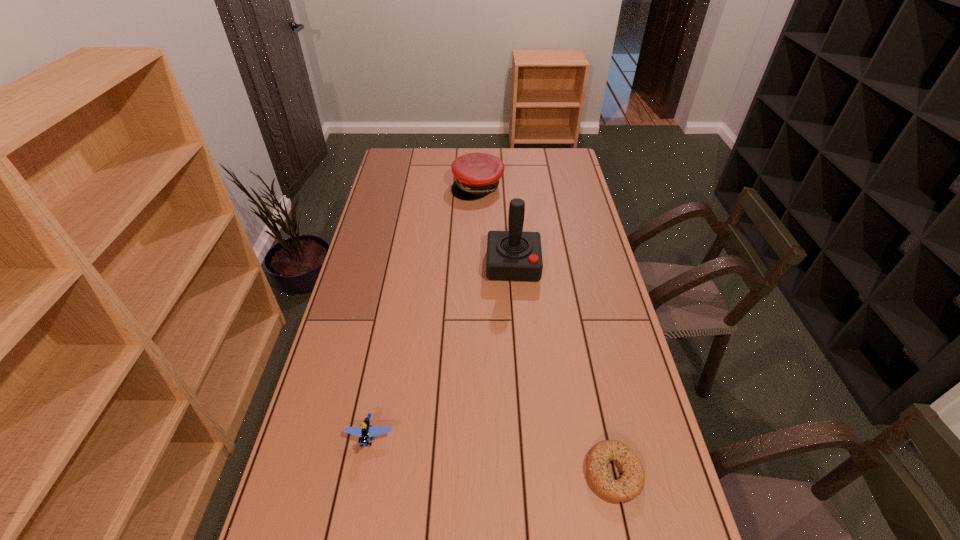
Locate an element on the screen. This screenshot has width=960, height=540. vacant region between the bagel and the farthest object is located at coordinates (545, 330).

I want to click on unoccupied position between the bagel and the second tallest object, so click(545, 330).

This screenshot has width=960, height=540. Find the location of `vacant region between the Lego and the rightmost object`. vacant region between the Lego and the rightmost object is located at coordinates (492, 455).

Identify the location of free point between the joystick and the shortest object. The image size is (960, 540). (564, 369).

I want to click on vacant space that is in between the second farthest object and the Lego, so click(442, 351).

Locate an element on the screen. This screenshot has height=540, width=960. blank region between the second shortest object and the shortest object is located at coordinates (492, 455).

I want to click on vacant region between the shortest object and the leftmost object, so click(492, 455).

Point out which object is positioned as the nearest to the tallest object. Please provide its 2D coordinates. Your answer should be formatted as a tuple, i.e. [(x, y)], where the tuple contains the x and y coordinates of a point satisfying the conditions above.

[(477, 174)]

At what (x,y) coordinates should I click in order to perform the action: click on the third closest object to the third shortest object. Please return your answer as a coordinate pair (x, y). The height and width of the screenshot is (540, 960). Looking at the image, I should click on (631, 483).

At what (x,y) coordinates should I click in order to perform the action: click on free location that satisfies the following two spatial constraints: 1. on the front side of the third shortest object; 2. on the left side of the second farthest object. Please return your answer as a coordinate pair (x, y). The height and width of the screenshot is (540, 960). Looking at the image, I should click on (477, 265).